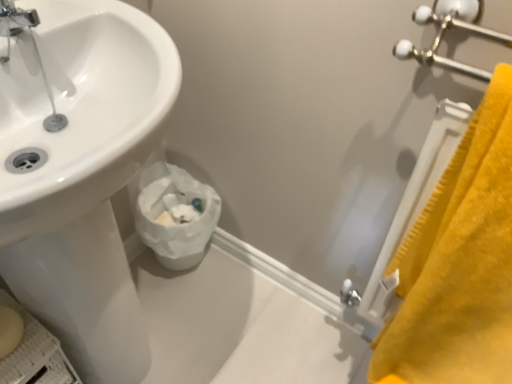
Question: Does yellow plush bath towel at right have a lesser height compared to chrome metallic faucet at upper left?

Choices:
 (A) no
 (B) yes

Answer: (A)

Question: Is chrome metallic faucet at upper left located within yellow plush bath towel at right?

Choices:
 (A) yes
 (B) no

Answer: (B)

Question: Does yellow plush bath towel at right appear on the right side of chrome metallic faucet at upper left?

Choices:
 (A) no
 (B) yes

Answer: (B)

Question: Is yellow plush bath towel at right further to the viewer compared to chrome metallic faucet at upper left?

Choices:
 (A) no
 (B) yes

Answer: (A)

Question: From a real-world perspective, is yellow plush bath towel at right beneath chrome metallic faucet at upper left?

Choices:
 (A) no
 (B) yes

Answer: (B)

Question: Considering their positions, is yellow plush bath towel at right located in front of or behind chrome metallic faucet at upper left?

Choices:
 (A) behind
 (B) front

Answer: (B)

Question: From their relative heights in the image, would you say yellow plush bath towel at right is taller or shorter than chrome metallic faucet at upper left?

Choices:
 (A) tall
 (B) short

Answer: (A)

Question: Does point (490, 273) appear closer or farther from the camera than point (13, 19)?

Choices:
 (A) farther
 (B) closer

Answer: (A)

Question: Is yellow plush bath towel at right wider or thinner than chrome metallic faucet at upper left?

Choices:
 (A) wide
 (B) thin

Answer: (A)

Question: From the image's perspective, is yellow plush bath towel at right above or below white paper at lower center?

Choices:
 (A) below
 (B) above

Answer: (B)

Question: Looking at the image, does yellow plush bath towel at right seem bigger or smaller compared to white paper at lower center?

Choices:
 (A) big
 (B) small

Answer: (A)

Question: Choose the correct answer: Is yellow plush bath towel at right inside white paper at lower center or outside it?

Choices:
 (A) outside
 (B) inside

Answer: (A)

Question: Is point (452, 321) closer or farther from the camera than point (212, 203)?

Choices:
 (A) closer
 (B) farther

Answer: (A)

Question: In terms of width, does white paper at lower center look wider or thinner when compared to yellow plush bath towel at right?

Choices:
 (A) thin
 (B) wide

Answer: (B)

Question: From a real-world perspective, is white paper at lower center positioned above or below yellow plush bath towel at right?

Choices:
 (A) below
 (B) above

Answer: (A)